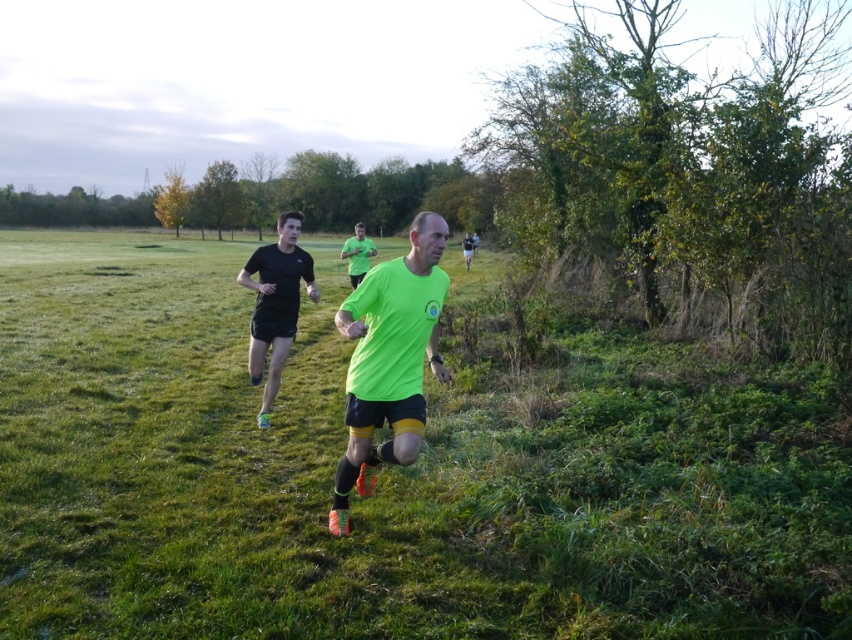
Does matte black shorts at center have a larger size compared to neon green t-shirt at center?

Incorrect, matte black shorts at center is not larger than neon green t-shirt at center.

You are a GUI agent. You are given a task and a screenshot of the screen. Output one action in this format:
    pyautogui.click(x=<x>, y=<y>)
    Task: Click on the matte black shorts at center
    
    Given the screenshot: What is the action you would take?
    pyautogui.click(x=275, y=304)

At what (x,y) coordinates should I click in order to perform the action: click on matte black shorts at center. Please return your answer as a coordinate pair (x, y). This screenshot has width=852, height=640. Looking at the image, I should click on point(275,304).

Is neon green fabric at center positioned before matte black shorts at center?

That is True.

What do you see at coordinates (390, 358) in the screenshot?
I see `neon green fabric at center` at bounding box center [390, 358].

I want to click on neon green fabric at center, so click(x=390, y=358).

Can you confirm if green grass at center is positioned to the left of neon green t-shirt at center?

Correct, you'll find green grass at center to the left of neon green t-shirt at center.

Which is behind, point (137, 344) or point (366, 241)?

The point (366, 241) is behind.

The width and height of the screenshot is (852, 640). In order to click on green grass at center in this screenshot , I will do `click(389, 472)`.

In order to click on green grass at center in this screenshot , I will do `click(389, 472)`.